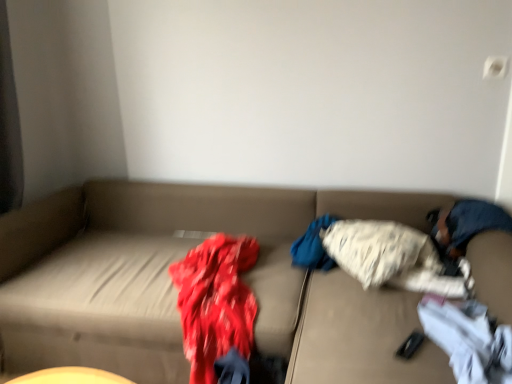
Question: Considering the positions of point (457, 324) and point (435, 230), is point (457, 324) closer or farther from the camera than point (435, 230)?

Choices:
 (A) closer
 (B) farther

Answer: (A)

Question: Considering the positions of white cotton socks at lower right, which is the 2th clothing in back-to-front order, and blue denim jeans at right in the image, is white cotton socks at lower right, which is the 2th clothing in back-to-front order, taller or shorter than blue denim jeans at right?

Choices:
 (A) short
 (B) tall

Answer: (A)

Question: Based on their relative distances, which object is nearer to the fluffy white blanket at center, which is counted as the 1th clothing, starting from the back?

Choices:
 (A) white cotton socks at lower right, which is the 2th clothing in back-to-front order
 (B) beige fabric couch at center
 (C) blue denim jeans at right

Answer: (C)

Question: Which is farther from the white cotton socks at lower right, the first clothing from the front?

Choices:
 (A) beige fabric couch at center
 (B) blue denim jeans at right
 (C) fluffy white blanket at center, the second clothing from the front

Answer: (A)